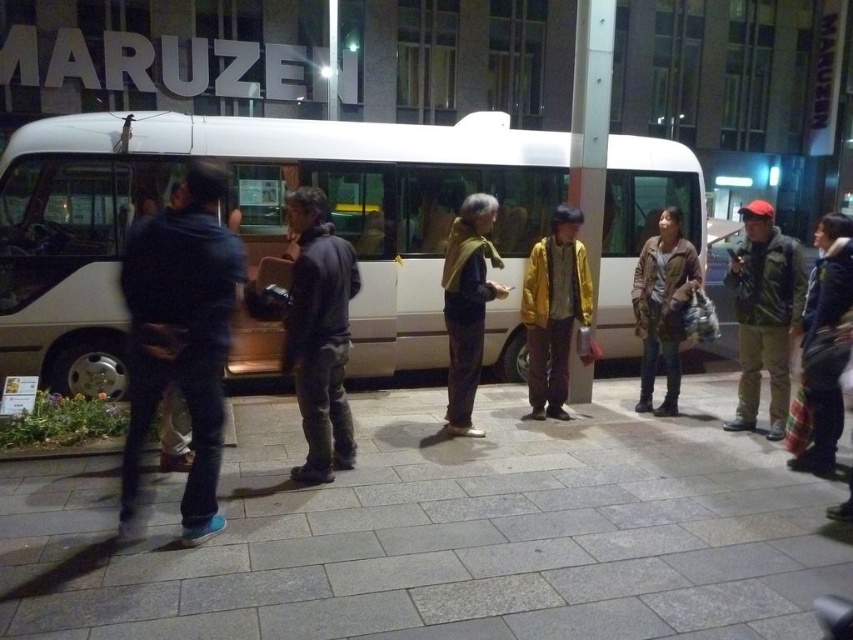
Question: Observing the image, what is the correct spatial positioning of dark gray fabric jacket at center in reference to striped fabric jacket at right?

Choices:
 (A) left
 (B) right

Answer: (A)

Question: Which point is closer to the camera?

Choices:
 (A) (532, 401)
 (B) (451, 236)
 (C) (851, 244)

Answer: (C)

Question: Is white matte bus at center behind dark gray fabric jacket at center?

Choices:
 (A) yes
 (B) no

Answer: (A)

Question: Which object appears farthest from the camera in this image?

Choices:
 (A) brown leather jacket at center
 (B) gray concrete pavement at center
 (C) camouflage jacket at right
 (D) white matte bus at center

Answer: (D)

Question: Which of the following is the farthest from the observer?

Choices:
 (A) dark blue fabric jacket at left
 (B) brown leather jacket at center

Answer: (B)

Question: Is gray concrete pavement at center above striped fabric jacket at right?

Choices:
 (A) yes
 (B) no

Answer: (B)